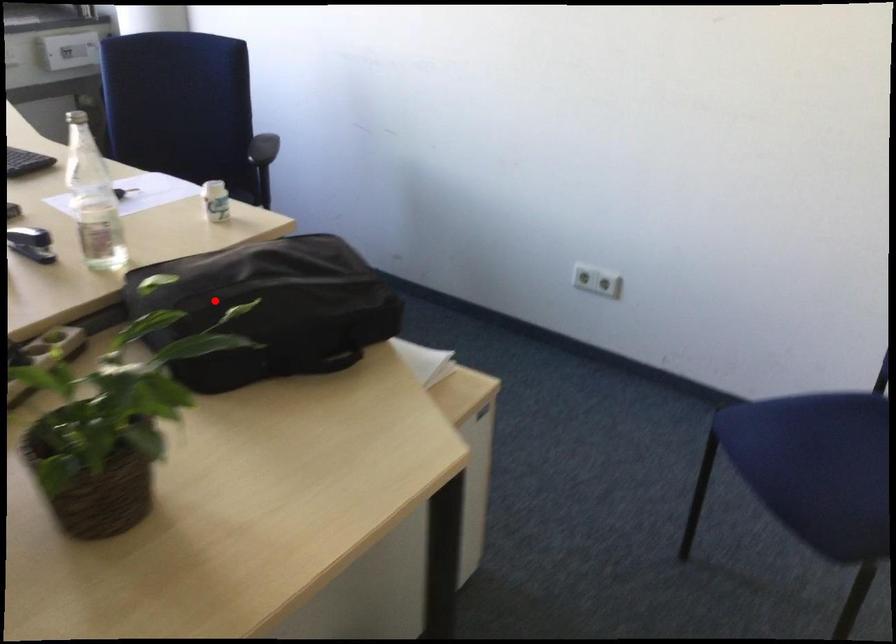
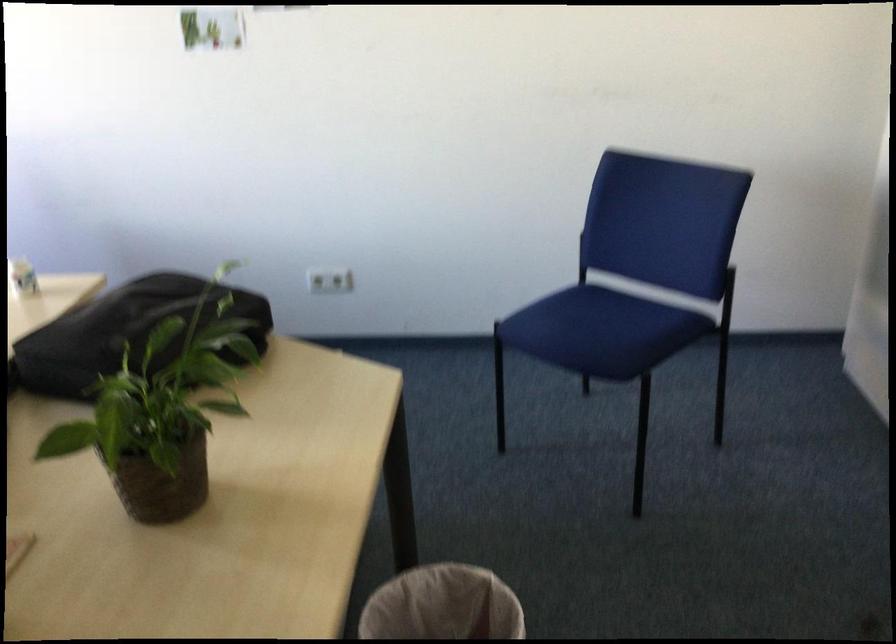
Question: A red point is marked in image1. In image2, is the corresponding 3D point closer to the camera or farther? Reply with the corresponding letter.

Choices:
 (A) The corresponding 3D point is closer.
 (B) The corresponding 3D point is farther.

Answer: (B)